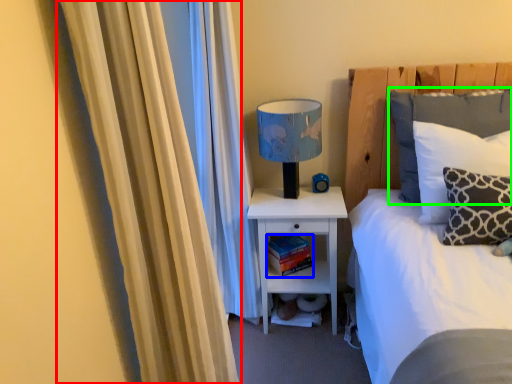
Question: Which object is the farthest from curtain (highlighted by a red box)? Choose among these: book (highlighted by a blue box) or pillow (highlighted by a green box).

Choices:
 (A) book
 (B) pillow

Answer: (A)